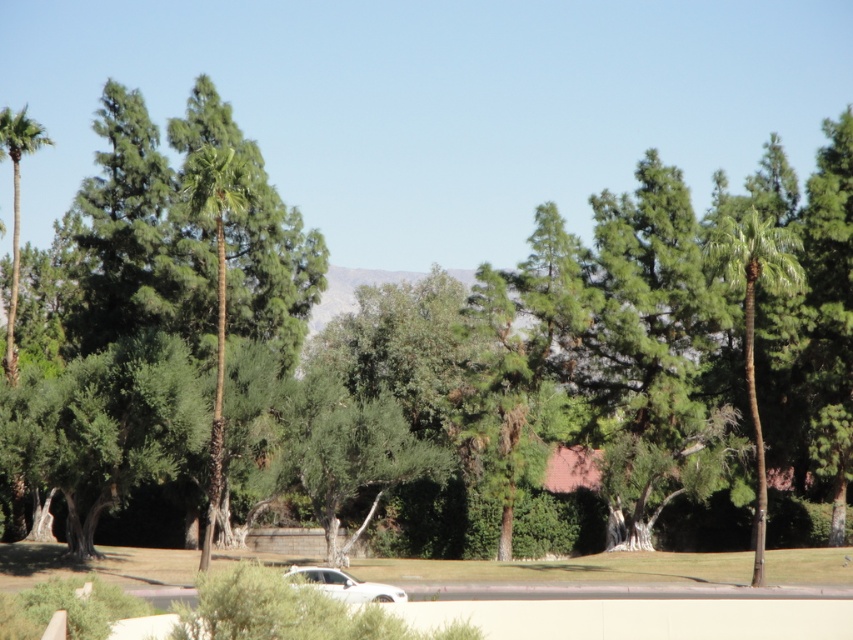
Between point (202, 177) and point (18, 170), which one is positioned behind?

Positioned behind is point (18, 170).

Identify the location of green leafy palm tree at center. This screenshot has width=853, height=640. (218, 289).

Between point (12, 166) and point (364, 582), which one is positioned in front?

Point (364, 582) is more forward.

Is point (12, 243) farther from camera compared to point (387, 584)?

Yes.

Does point (10, 376) lie in front of point (387, 589)?

No, (10, 376) is further to viewer.

This screenshot has width=853, height=640. I want to click on green leafy palm tree at left, so click(16, 209).

Is green textured palm tree at right to the right of green leafy palm tree at left from the viewer's perspective?

Indeed, green textured palm tree at right is positioned on the right side of green leafy palm tree at left.

Who is more distant from viewer, (792, 282) or (9, 336)?

The point (9, 336) is behind.

In order to click on green textured palm tree at right in this screenshot , I will do `click(753, 314)`.